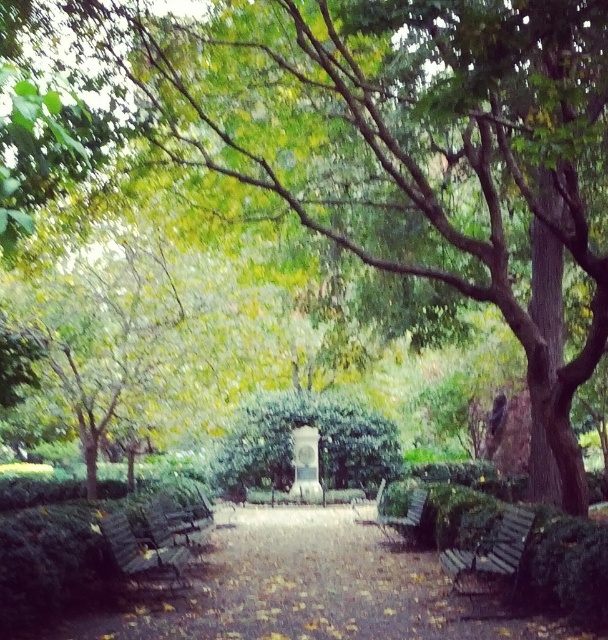
Consider the image. Which is more to the right, green leafy hedge at center or wooden bench at center?

green leafy hedge at center

Between point (334, 472) and point (150, 525), which one is positioned behind?

The point (334, 472) is more distant.

Find the location of a particular element. The height and width of the screenshot is (640, 608). green leafy hedge at center is located at coordinates (294, 442).

Measure the distance between green leafy hedge at lower left and camera.

green leafy hedge at lower left and camera are 4.11 meters apart from each other.

Is green leafy hedge at lower left below wooden bench at center?

Incorrect, green leafy hedge at lower left is not positioned below wooden bench at center.

Identify the location of green leafy hedge at lower left. (50, 563).

This screenshot has height=640, width=608. I want to click on green leafy hedge at lower left, so click(x=50, y=563).

Can you confirm if brown wooden bench at center is smaller than wooden bench at center?

Indeed, brown wooden bench at center has a smaller size compared to wooden bench at center.

Can you confirm if brown wooden bench at center is taller than wooden bench at center?

No.

Who is more forward, (237, 628) or (185, 529)?

Point (237, 628)

At what (x,y) coordinates should I click in order to perform the action: click on brown wooden bench at center. Please return your answer as a coordinate pair (x, y). The image size is (608, 640). Looking at the image, I should click on (305, 588).